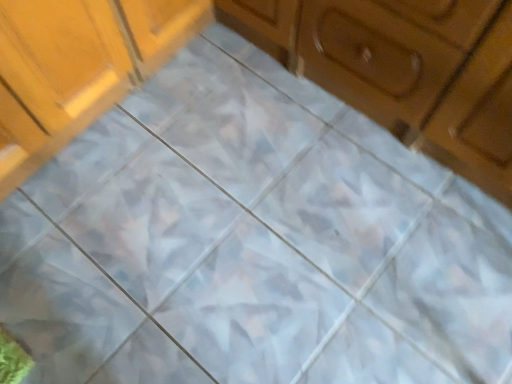
Question: Is wooden cabinet at upper right, which ranks as the second cabinetry in left-to-right order, further to the viewer compared to matte wood cabinet at upper left, which is counted as the second cabinetry, starting from the right?

Choices:
 (A) yes
 (B) no

Answer: (B)

Question: Can you confirm if wooden cabinet at upper right, the first cabinetry positioned from the right, is bigger than matte wood cabinet at upper left, placed as the first cabinetry when sorted from left to right?

Choices:
 (A) no
 (B) yes

Answer: (B)

Question: From the image's perspective, is wooden cabinet at upper right, the first cabinetry positioned from the right, on top of matte wood cabinet at upper left, which is counted as the second cabinetry, starting from the right?

Choices:
 (A) no
 (B) yes

Answer: (A)

Question: Is wooden cabinet at upper right, which ranks as the second cabinetry in left-to-right order, in front of matte wood cabinet at upper left, placed as the first cabinetry when sorted from left to right?

Choices:
 (A) no
 (B) yes

Answer: (B)

Question: Is there a large distance between wooden cabinet at upper right, the first cabinetry positioned from the right, and matte wood cabinet at upper left, placed as the first cabinetry when sorted from left to right?

Choices:
 (A) no
 (B) yes

Answer: (A)

Question: Is wooden cabinet at upper right, which ranks as the second cabinetry in left-to-right order, smaller than matte wood cabinet at upper left, placed as the first cabinetry when sorted from left to right?

Choices:
 (A) yes
 (B) no

Answer: (B)

Question: Is matte wood cabinet at upper left, placed as the first cabinetry when sorted from left to right, positioned before wooden cabinet at upper right, which ranks as the second cabinetry in left-to-right order?

Choices:
 (A) no
 (B) yes

Answer: (A)

Question: Does matte wood cabinet at upper left, which is counted as the second cabinetry, starting from the right, touch wooden cabinet at upper right, which ranks as the second cabinetry in left-to-right order?

Choices:
 (A) yes
 (B) no

Answer: (B)

Question: From a real-world perspective, is matte wood cabinet at upper left, placed as the first cabinetry when sorted from left to right, on wooden cabinet at upper right, which ranks as the second cabinetry in left-to-right order?

Choices:
 (A) no
 (B) yes

Answer: (A)

Question: Is matte wood cabinet at upper left, placed as the first cabinetry when sorted from left to right, bigger than wooden cabinet at upper right, which ranks as the second cabinetry in left-to-right order?

Choices:
 (A) yes
 (B) no

Answer: (B)

Question: Considering the relative positions of matte wood cabinet at upper left, placed as the first cabinetry when sorted from left to right, and wooden cabinet at upper right, the first cabinetry positioned from the right, in the image provided, is matte wood cabinet at upper left, placed as the first cabinetry when sorted from left to right, behind wooden cabinet at upper right, the first cabinetry positioned from the right,?

Choices:
 (A) yes
 (B) no

Answer: (A)

Question: Is matte wood cabinet at upper left, placed as the first cabinetry when sorted from left to right, to the left of wooden cabinet at upper right, which ranks as the second cabinetry in left-to-right order, from the viewer's perspective?

Choices:
 (A) no
 (B) yes

Answer: (B)

Question: Considering their positions, is wooden cabinet at upper right, the first cabinetry positioned from the right, located in front of or behind matte wood cabinet at upper left, which is counted as the second cabinetry, starting from the right?

Choices:
 (A) front
 (B) behind

Answer: (A)